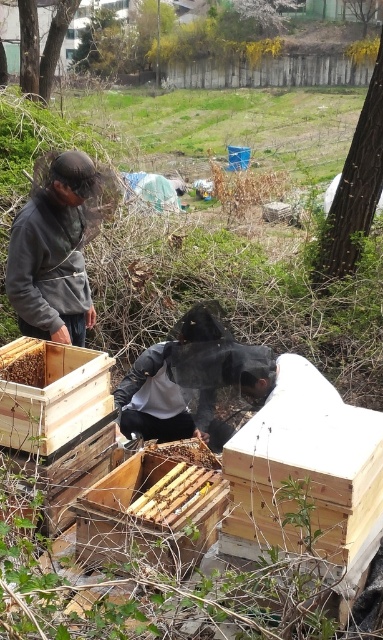
Question: Is wooden beehive at center to the right of brown wooden beehive at lower left from the viewer's perspective?

Choices:
 (A) no
 (B) yes

Answer: (B)

Question: Which of these objects is positioned closest to the wooden beehive at center?

Choices:
 (A) wooden beehive at lower left
 (B) brown wooden bee at center
 (C) brown wooden beehive at lower left

Answer: (B)

Question: Does brown wooden beehive at lower left appear under brown wooden bee at center?

Choices:
 (A) no
 (B) yes

Answer: (A)

Question: Does wooden beehive at center appear under brown wooden beehive at lower left?

Choices:
 (A) no
 (B) yes

Answer: (B)

Question: Estimate the real-world distances between objects in this image. Which object is closer to the brown wooden bee at center?

Choices:
 (A) gray fleece jacket at left
 (B) brown wooden beehive at lower left

Answer: (B)

Question: Which of the following is the farthest from the observer?

Choices:
 (A) (62, 381)
 (B) (189, 456)
 (C) (11, 364)
 (D) (11, 236)

Answer: (D)